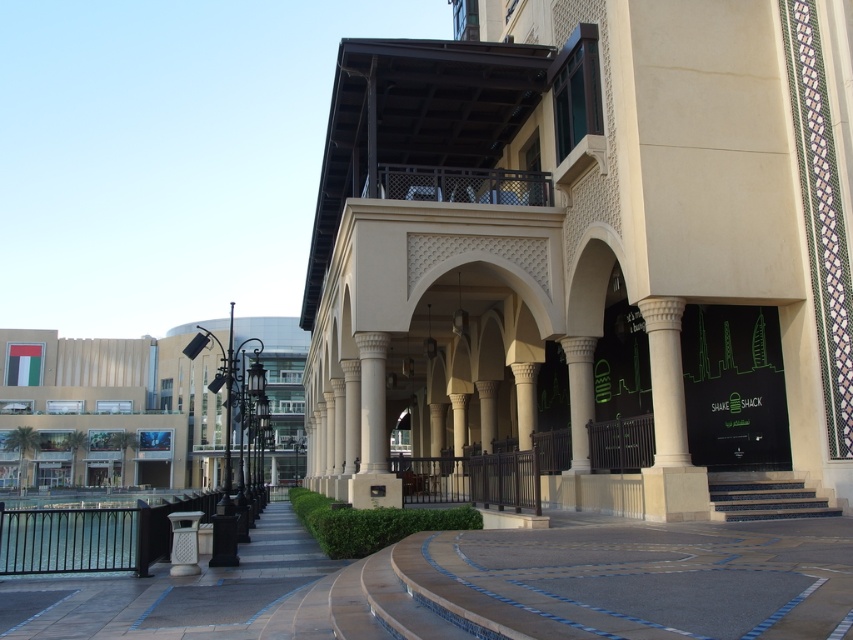
Is beige stone building at center behind white stone column at center?

No, beige stone building at center is in front of white stone column at center.

Between point (775, 474) and point (381, 401), which one is positioned behind?

Point (381, 401)

This screenshot has height=640, width=853. Identify the location of beige stone building at center. (596, 244).

Between smooth stone pavement at center and white marble pillar at center, which one has less height?

white marble pillar at center

Is smooth stone pavement at center positioned in front of white marble pillar at center?

Yes.

Find the location of a particular element. smooth stone pavement at center is located at coordinates (666, 573).

Identify the location of smooth stone pavement at center. The height and width of the screenshot is (640, 853). (666, 573).

Is matte beige building at left above white marble column at center?

Actually, matte beige building at left is below white marble column at center.

Which of these two, matte beige building at left or white marble column at center, stands taller?

matte beige building at left

Describe the element at coordinates (117, 404) in the screenshot. I see `matte beige building at left` at that location.

Locate an element on the screen. Image resolution: width=853 pixels, height=640 pixels. matte beige building at left is located at coordinates (117, 404).